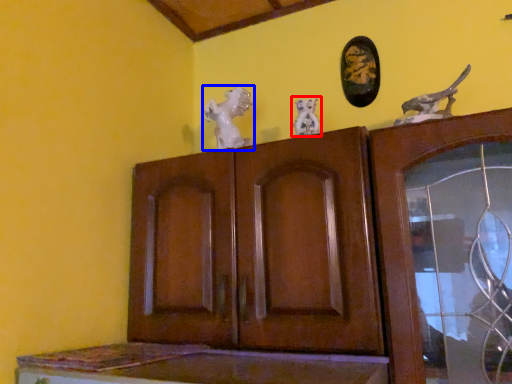
Question: Which of the following is the farthest to the observer, animal sculpture (highlighted by a red box) or animal (highlighted by a blue box)?

Choices:
 (A) animal sculpture
 (B) animal

Answer: (B)